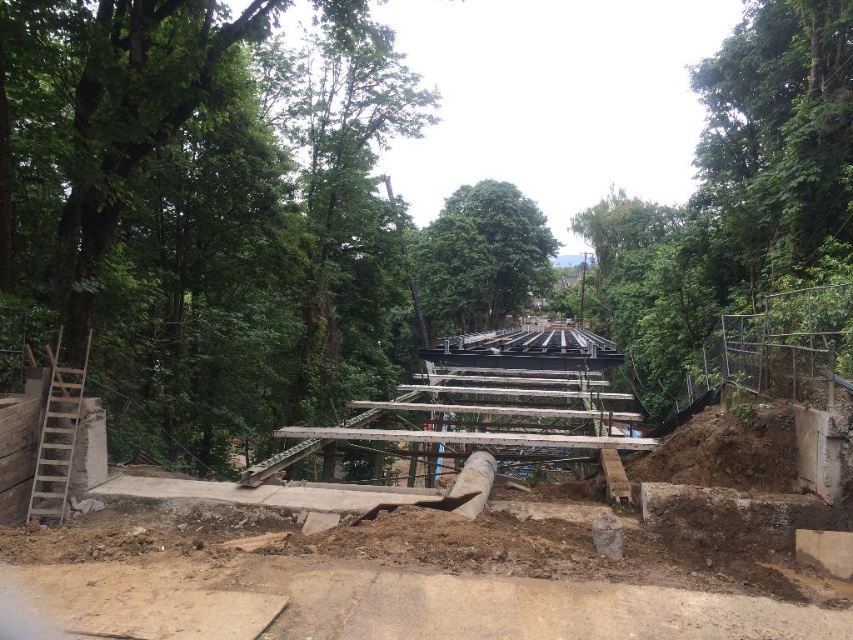
Based on the photo, you are a delivery truck driver arriving at the construction site. You need to drive along the brown dirt track at lower left to reach the green leafy tree at upper right. Can your truck, which is 2.5 meters wide, safely pass through the track?

The brown dirt track at lower left is narrower than the green leafy tree at upper right, but the description does not provide specific width measurements. Therefore, it is uncertain whether the truck can safely pass through the track.

You are a construction worker standing at the brown dirt track at lower left and need to reach the green leafy tree at center. Which object is taller, and how does this affect your path?

The green leafy tree at center is taller than the brown dirt track at lower left. Since the tree is taller, you may need to navigate around it or plan your path accordingly to avoid obstacles caused by its height.

You are a construction worker who needs to move a heavy beam from the concrete stairs at center to the green leafy tree at upper right. Given that the beam is 10 meters long, will it be possible to transport it horizontally without bending or breaking the beam?

The distance between the concrete stairs at center and the green leafy tree at upper right is 15.21 meters. Since the beam is only 10 meters long, it cannot span the entire distance. Therefore, it would not be possible to transport the beam horizontally without bending or breaking it.